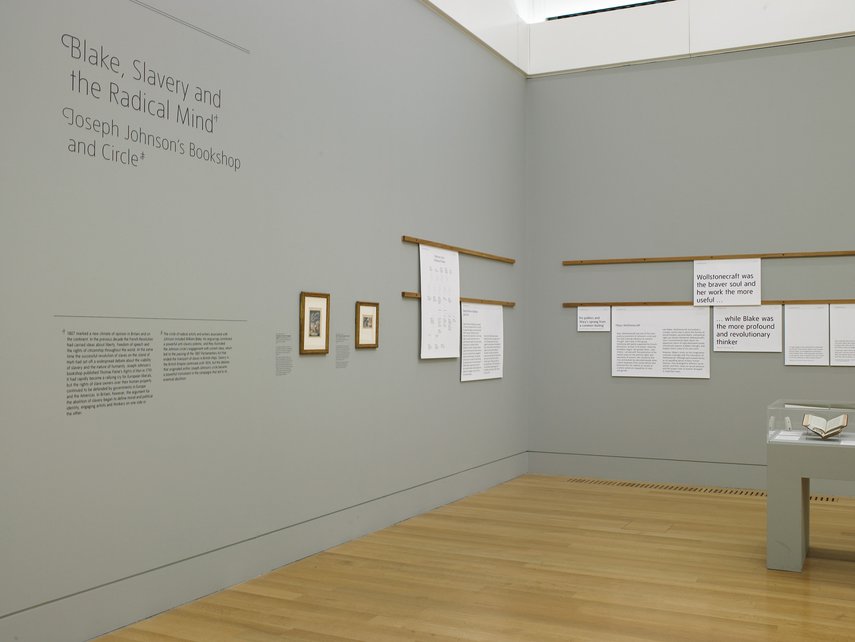
Where is `1 display table`? The image size is (855, 642). 1 display table is located at coordinates (830, 465).